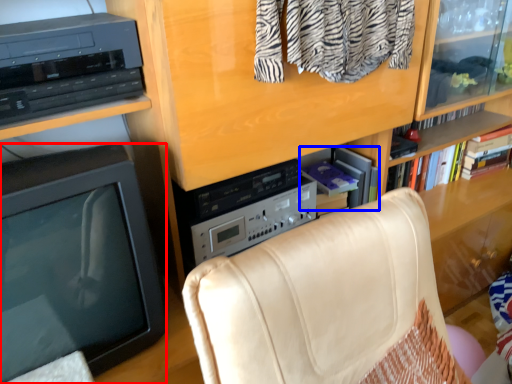
Question: Which point is further to the camera, television (highlighted by a red box) or book (highlighted by a blue box)?

Choices:
 (A) television
 (B) book

Answer: (B)